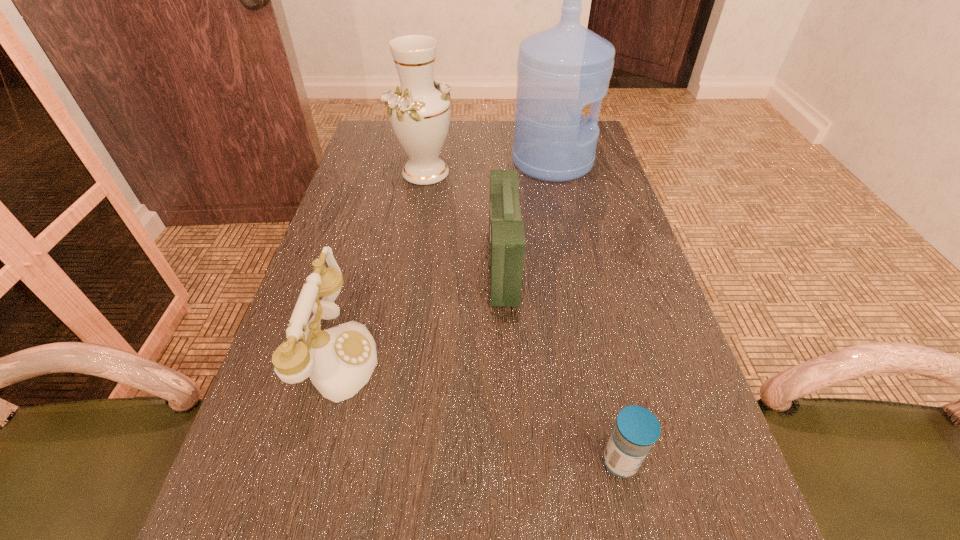
At what (x,y) coordinates should I click in order to perform the action: click on empty space that is in between the medicine and the first-aid kit. Please return your answer as a coordinate pair (x, y). Looking at the image, I should click on (562, 363).

Locate an element on the screen. This screenshot has width=960, height=540. free space between the telephone and the vase is located at coordinates (382, 264).

I want to click on vacant area that lies between the telephone and the medicine, so click(479, 408).

In order to click on free space between the shortest object and the third object from left to right in this screenshot , I will do `click(562, 363)`.

Identify which object is located as the second nearest to the first-aid kit. Please provide its 2D coordinates. Your answer should be formatted as a tuple, i.e. [(x, y)], where the tuple contains the x and y coordinates of a point satisfying the conditions above.

[(561, 69)]

Locate an element on the screen. the closest object to the telephone is located at coordinates (507, 243).

Identify the location of free space that satisfies the following two spatial constraints: 1. on the front-facing side of the first-aid kit; 2. on the left side of the shortest object. The width and height of the screenshot is (960, 540). (514, 461).

Where is `vacant space that satisfies the following two spatial constraints: 1. on the dial of the shortest object; 2. on the right side of the telephone`? This screenshot has height=540, width=960. vacant space that satisfies the following two spatial constraints: 1. on the dial of the shortest object; 2. on the right side of the telephone is located at coordinates (310, 461).

You are a GUI agent. You are given a task and a screenshot of the screen. Output one action in this format:
    pyautogui.click(x=<x>, y=<y>)
    Task: Click on the vacant area in the image that satisfies the following two spatial constraints: 1. on the front-facing side of the first-aid kit; 2. on the right side of the shortest object
    Image resolution: width=960 pixels, height=540 pixels.
    Given the screenshot: What is the action you would take?
    pyautogui.click(x=514, y=461)

Identify the location of vacant area that satisfies the following two spatial constraints: 1. on the front-facing side of the shortest object; 2. on the left side of the third object from left to right. (514, 461).